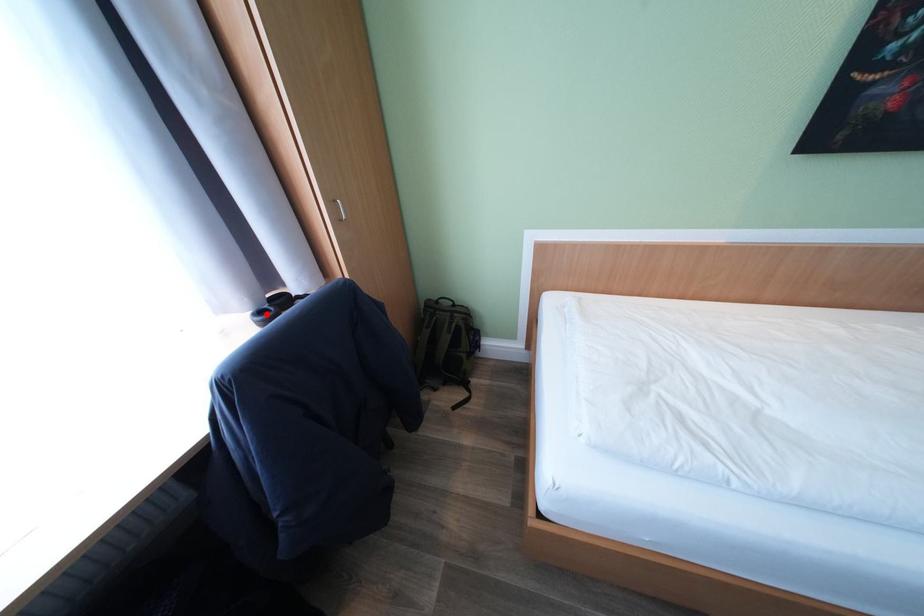
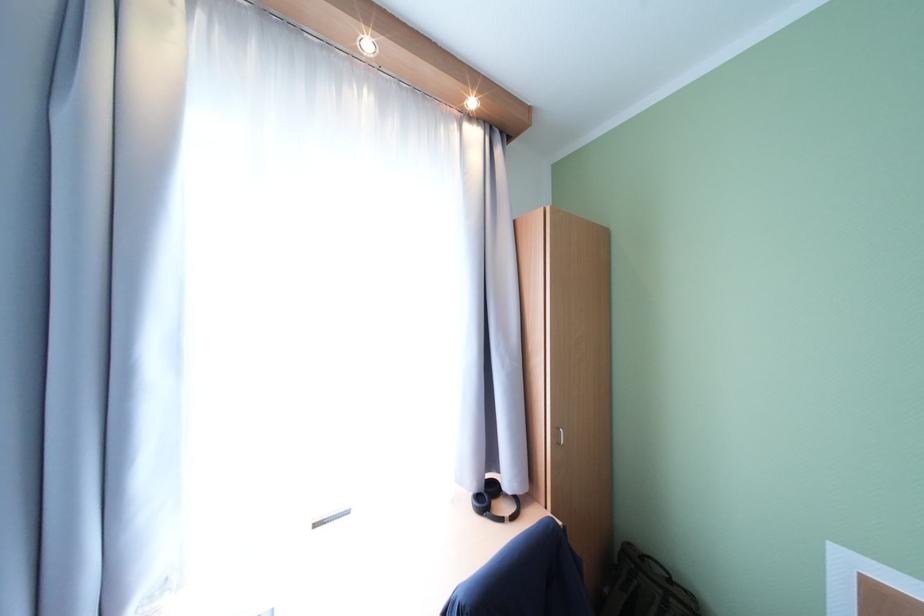
In the second image, find the point that corresponds to the highlighted location in the first image.

(484, 498)